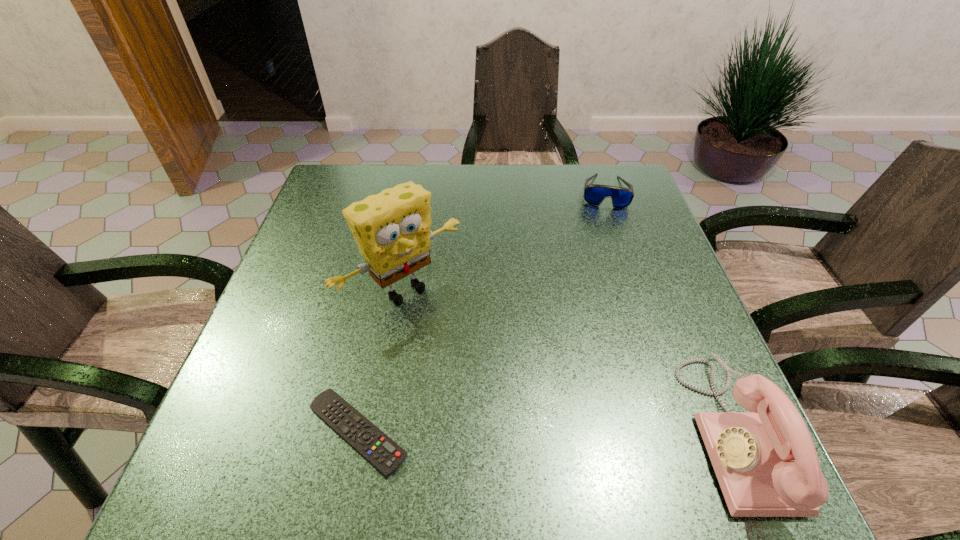
What are the coordinates of `sponge at the left edge` in the screenshot? It's located at (392, 229).

Locate an element on the screen. The image size is (960, 540). telephone located at the right edge is located at coordinates (765, 460).

Identify the location of sunglasses that is at the right edge. This screenshot has height=540, width=960. (594, 194).

You are a GUI agent. You are given a task and a screenshot of the screen. Output one action in this format:
    pyautogui.click(x=<x>, y=<y>)
    Task: Click on the object at the near left corner
    
    Given the screenshot: What is the action you would take?
    pyautogui.click(x=385, y=455)

Find the location of a particular element. The height and width of the screenshot is (540, 960). object that is at the far right corner is located at coordinates (594, 194).

Find the location of a particular element. The image size is (960, 540). object present at the near right corner is located at coordinates (765, 460).

You are a GUI agent. You are given a task and a screenshot of the screen. Output one action in this format:
    pyautogui.click(x=<x>, y=<y>)
    Task: Click on the vacant space at the far edge of the desktop
    The image size is (960, 540).
    Given the screenshot: What is the action you would take?
    pyautogui.click(x=445, y=188)

Identify the location of vacant space at the near edge. (504, 414).

Where is `vacant space at the left edge of the desktop`? vacant space at the left edge of the desktop is located at coordinates 346,261.

Identify the location of vacant space at the right edge of the desktop. The height and width of the screenshot is (540, 960). (600, 241).